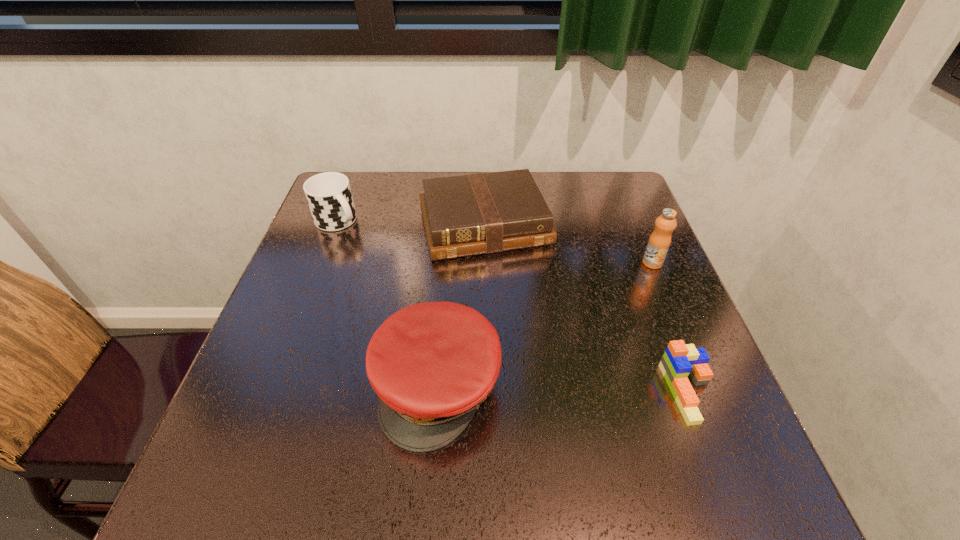
At what (x,y) coordinates should I click in order to perform the action: click on free location that satisfies the following two spatial constraints: 1. on the front side of the Bible; 2. on the right side of the Lego. Please return your answer as a coordinate pair (x, y). The width and height of the screenshot is (960, 540). Looking at the image, I should click on (486, 392).

Find the location of a particular element. Image resolution: width=960 pixels, height=540 pixels. free spot that satisfies the following two spatial constraints: 1. on the front side of the Lego; 2. on the right side of the leftmost object is located at coordinates (272, 392).